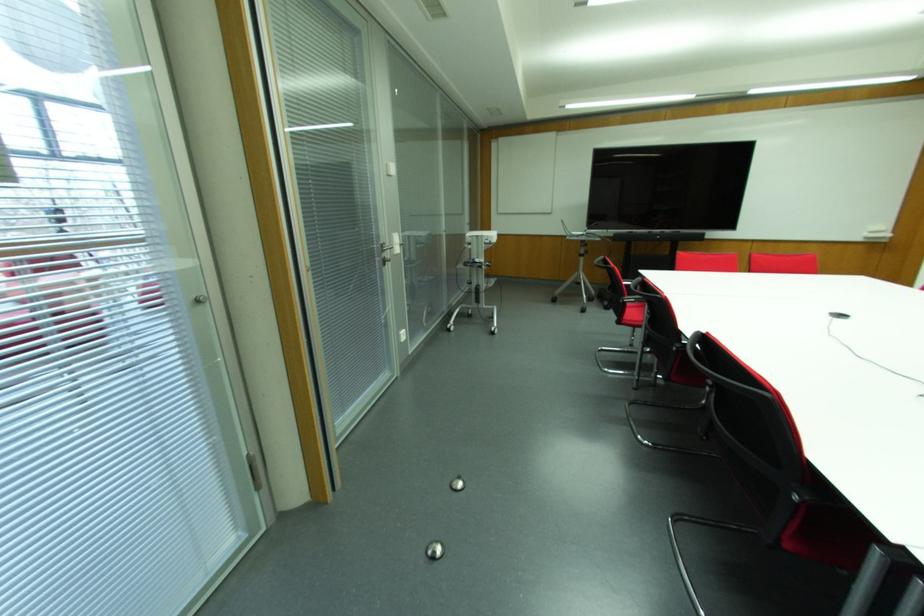
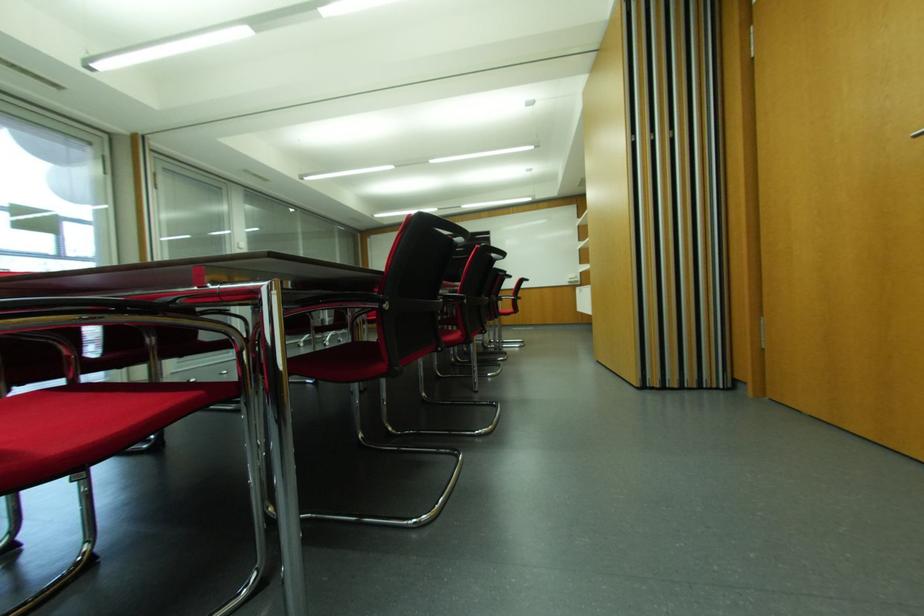
The images are taken continuously from a first-person perspective. In which direction are you moving?

The cameraman walked toward right, backward.